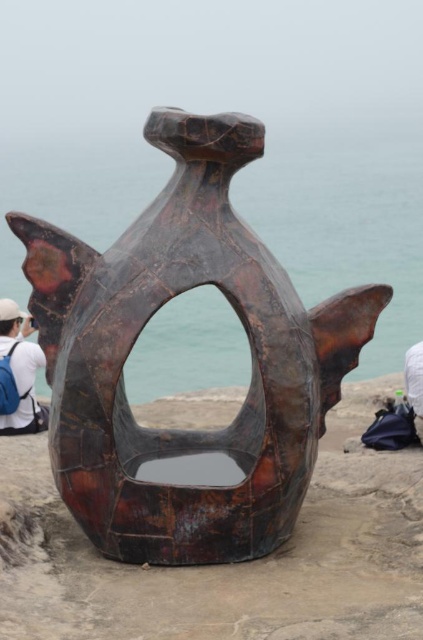
Which is behind, point (90, 406) or point (54, 550)?

Positioned behind is point (54, 550).

Describe the element at coordinates (140, 332) in the screenshot. The image size is (423, 640). I see `rusty metal fish at center` at that location.

Find the location of a particular element. This screenshot has height=640, width=423. rusty metal fish at center is located at coordinates (140, 332).

Can you confirm if rusty metal sculpture at center is bigger than white fabric at upper left?

Correct, rusty metal sculpture at center is larger in size than white fabric at upper left.

Is rusty metal sculpture at center taller than white fabric at upper left?

Incorrect, rusty metal sculpture at center's height is not larger of white fabric at upper left's.

Describe the element at coordinates (228, 564) in the screenshot. The height and width of the screenshot is (640, 423). I see `rusty metal sculpture at center` at that location.

At what (x,y) coordinates should I click in order to perform the action: click on rusty metal sculpture at center. Please return your answer as a coordinate pair (x, y). This screenshot has height=640, width=423. Looking at the image, I should click on (228, 564).

Who is taller, rusty metal fish at center or white fabric at upper left?

rusty metal fish at center

Is rusty metal fish at center closer to the viewer compared to white fabric at upper left?

That is True.

At what (x,y) coordinates should I click in order to perform the action: click on rusty metal fish at center. Please return your answer as a coordinate pair (x, y). Image resolution: width=423 pixels, height=640 pixels. Looking at the image, I should click on pos(140,332).